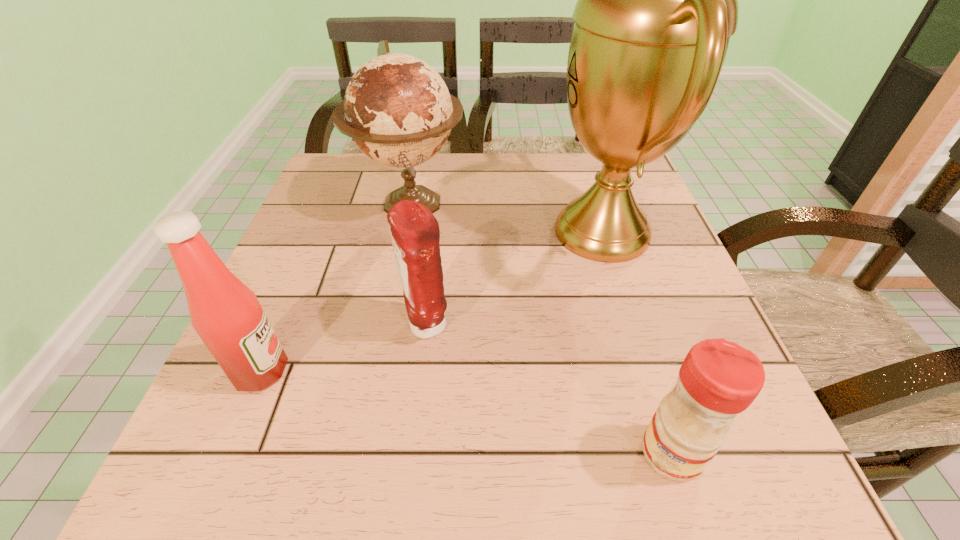
Locate an element on the screen. Image resolution: width=960 pixels, height=540 pixels. the tallest object is located at coordinates (657, 0).

Where is `globe`? The height and width of the screenshot is (540, 960). globe is located at coordinates (397, 108).

You are a GUI agent. You are given a task and a screenshot of the screen. Output one action in this format:
    pyautogui.click(x=<x>, y=<y>)
    Task: Click on the tallest condiment
    
    Given the screenshot: What is the action you would take?
    pyautogui.click(x=226, y=314)

At what (x,y) coordinates should I click in order to perform the action: click on the leftmost object. Please return your answer as a coordinate pair (x, y). This screenshot has height=540, width=960. Looking at the image, I should click on (226, 314).

At what (x,y) coordinates should I click in order to perform the action: click on the second condiment from right to left. Please return your answer as a coordinate pair (x, y). This screenshot has width=960, height=540. Looking at the image, I should click on (415, 233).

This screenshot has width=960, height=540. What are the coordinates of `the nearest object` in the screenshot? It's located at (718, 379).

Find the location of a particular element. the nearest condiment is located at coordinates (718, 379).

Identify the location of free space located 0.050m on the surface of the trophy cup with symbols. (523, 232).

This screenshot has width=960, height=540. Identify the location of vacant space located on the surface of the trophy cup with symbols. (523, 232).

At what (x,y) coordinates should I click in order to perform the action: click on vacant space located 0.350m on the surface of the trophy cup with symbols. Please return your answer as a coordinate pair (x, y). Looking at the image, I should click on pos(386,232).